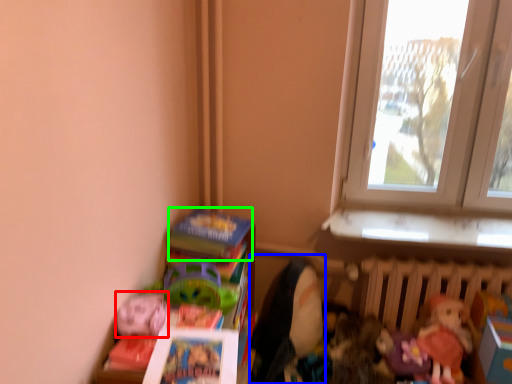
Question: Which object is the closest to the toy (highlighted by a red box)? Choose among these: doll (highlighted by a blue box) or book (highlighted by a green box).

Choices:
 (A) doll
 (B) book

Answer: (B)